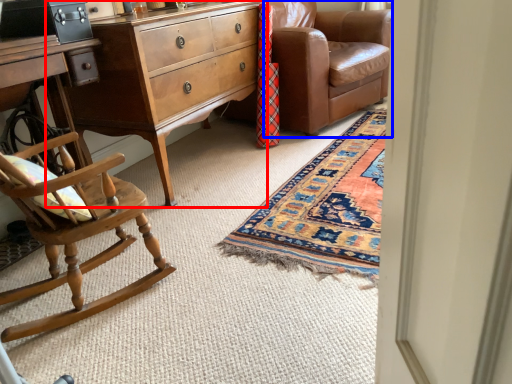
Question: Which point is further to the camera, nightstand (highlighted by a red box) or studio couch (highlighted by a blue box)?

Choices:
 (A) nightstand
 (B) studio couch

Answer: (B)